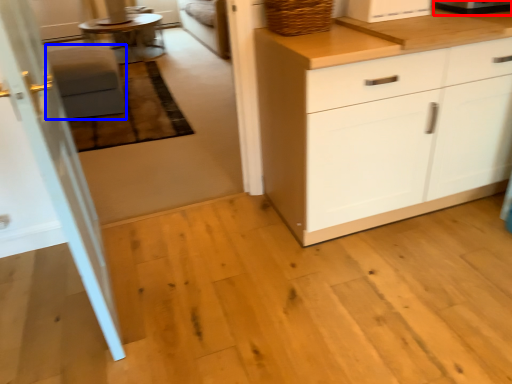
Question: Among these objects, which one is farthest to the camera, appliance (highlighted by a red box) or stool (highlighted by a blue box)?

Choices:
 (A) appliance
 (B) stool

Answer: (B)